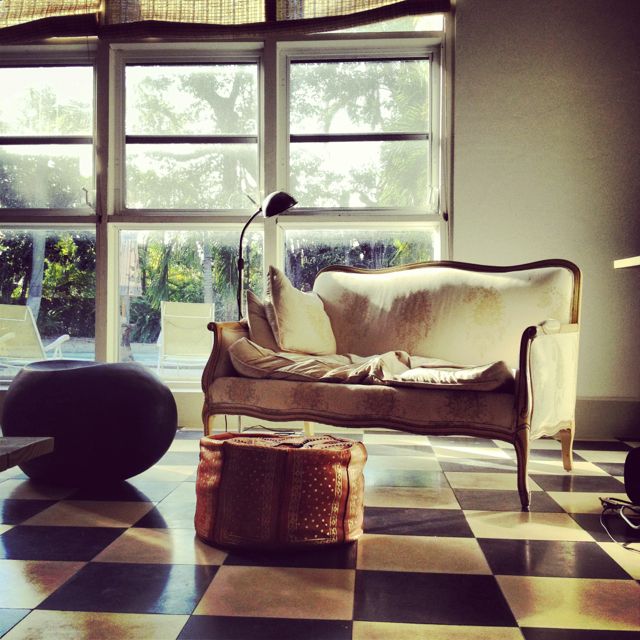
The image size is (640, 640). Find the location of `wall`. wall is located at coordinates (555, 140).